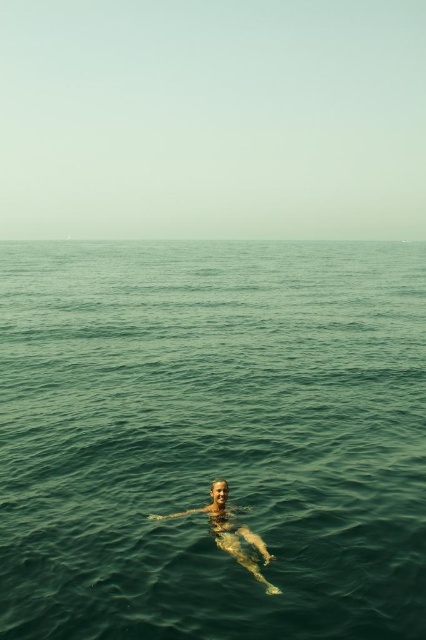
Based on the photo, who is positioned more to the right, green water at center or smooth skin person at center?

From the viewer's perspective, green water at center appears more on the right side.

Is green water at center to the right of smooth skin person at center from the viewer's perspective?

Indeed, green water at center is positioned on the right side of smooth skin person at center.

At what (x,y) coordinates should I click in order to perform the action: click on green water at center. Please return your answer as a coordinate pair (x, y). This screenshot has height=640, width=426. Looking at the image, I should click on 212,436.